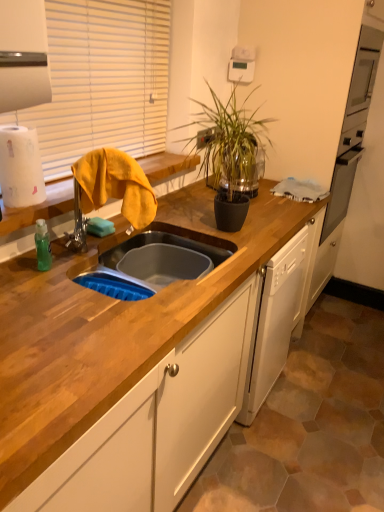
You are a GUI agent. You are given a task and a screenshot of the screen. Output one action in this format:
    pyautogui.click(x=<x>, y=<y>)
    Task: Click on the free space to the back side of green glossy plant at center
    This screenshot has height=512, width=384.
    Given the screenshot: What is the action you would take?
    pyautogui.click(x=212, y=196)